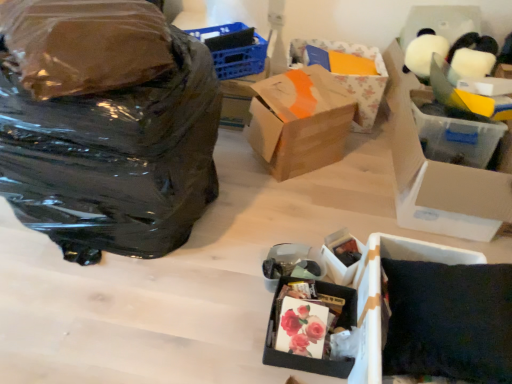
Question: Relative to brown cardboard box at center, which ranks as the 2th box in top-to-bottom order, is blue plastic basket at upper center in front or behind?

Choices:
 (A) front
 (B) behind

Answer: (B)

Question: Considering the positions of blue plastic basket at upper center and brown cardboard box at center, placed as the 4th box when sorted from bottom to top, in the image, is blue plastic basket at upper center wider or thinner than brown cardboard box at center, placed as the 4th box when sorted from bottom to top,?

Choices:
 (A) thin
 (B) wide

Answer: (A)

Question: Which of these objects is positioned farthest from the matte black box at lower center, the 5th box when ordered from top to bottom?

Choices:
 (A) matte black box at lower center, which is counted as the second box, starting from the bottom
 (B) black plastic bag at left
 (C) transparent plastic bag at left
 (D) brown cardboard box at center, placed as the 4th box when sorted from bottom to top
 (E) floral-patterned cardboard box at center, which is counted as the 5th box, starting from the bottom

Answer: (E)

Question: Which object is the closest to the transparent plastic bag at left?

Choices:
 (A) black plastic bag at left
 (B) matte black box at lower center, which is counted as the second box, starting from the bottom
 (C) brown cardboard box at center, placed as the 4th box when sorted from bottom to top
 (D) matte black box at lower center, the 5th box when ordered from top to bottom
 (E) floral-patterned cardboard box at center, the first box when ordered from top to bottom

Answer: (A)